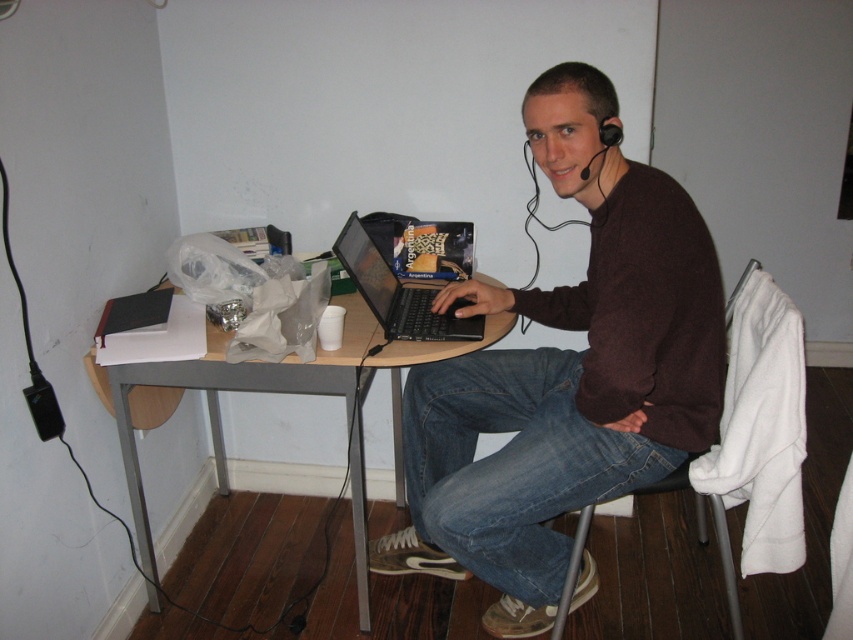
You need to place a new monitor that is the same size as the shiny black laptop at center on the desk. Will it fit next to the black plastic chair at lower center?

The shiny black laptop at center is smaller than the black plastic chair at lower center. Since the monitor is the same size as the laptop, it should fit next to the chair as it is smaller than the chair.